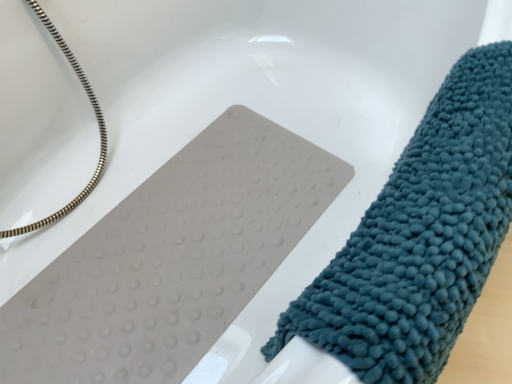
What do you see at coordinates (420, 237) in the screenshot? Image resolution: width=512 pixels, height=384 pixels. I see `teal textured towel at right` at bounding box center [420, 237].

Where is `teal textured towel at right`? The width and height of the screenshot is (512, 384). teal textured towel at right is located at coordinates (420, 237).

Measure the distance between silver metallic hose at upper left and camera.

silver metallic hose at upper left and camera are 32.68 inches apart.

Locate an element on the screen. The image size is (512, 384). silver metallic hose at upper left is located at coordinates (99, 131).

This screenshot has height=384, width=512. What do you see at coordinates (99, 131) in the screenshot? I see `silver metallic hose at upper left` at bounding box center [99, 131].

The height and width of the screenshot is (384, 512). I want to click on teal textured towel at right, so click(x=420, y=237).

Which is more to the right, silver metallic hose at upper left or teal textured towel at right?

teal textured towel at right.

Is silver metallic hose at upper left positioned before teal textured towel at right?

No, it is not.

Which is in front, point (79, 197) or point (422, 272)?

Positioned in front is point (422, 272).

From the image's perspective, which one is positioned lower, silver metallic hose at upper left or teal textured towel at right?

From the image's view, teal textured towel at right is below.

From a real-world perspective, relative to teal textured towel at right, is silver metallic hose at upper left vertically above or below?

Clearly, from a real-world perspective, silver metallic hose at upper left is below teal textured towel at right.

Which of these two, silver metallic hose at upper left or teal textured towel at right, is thinner?

teal textured towel at right.

Who is taller, silver metallic hose at upper left or teal textured towel at right?

silver metallic hose at upper left.

Considering the relative sizes of silver metallic hose at upper left and teal textured towel at right in the image provided, is silver metallic hose at upper left smaller than teal textured towel at right?

Actually, silver metallic hose at upper left might be larger than teal textured towel at right.

Do you think silver metallic hose at upper left is within teal textured towel at right, or outside of it?

silver metallic hose at upper left is located beyond the bounds of teal textured towel at right.

Is silver metallic hose at upper left not near teal textured towel at right?

Actually, silver metallic hose at upper left and teal textured towel at right are a little close together.

Is silver metallic hose at upper left looking in the opposite direction of teal textured towel at right?

No, silver metallic hose at upper left's orientation is not away from teal textured towel at right.

What's the angular difference between silver metallic hose at upper left and teal textured towel at right's facing directions?

They differ by 25 degrees in their facing directions.

Measure the distance from silver metallic hose at upper left to teal textured towel at right.

silver metallic hose at upper left and teal textured towel at right are 77.47 centimeters apart.

You are a GUI agent. You are given a task and a screenshot of the screen. Output one action in this format:
    pyautogui.click(x=<x>, y=<y>)
    Task: Click on the rope behind the teal textured towel at right
    
    Given the screenshot: What is the action you would take?
    pyautogui.click(x=99, y=131)

Does teal textured towel at right appear on the left side of silver metallic hose at upper left?

In fact, teal textured towel at right is to the right of silver metallic hose at upper left.

Which object is closer to the camera, teal textured towel at right or silver metallic hose at upper left?

teal textured towel at right is more forward.

Does point (337, 322) lie in front of point (27, 1)?

That is True.

From the image's perspective, which object appears higher, teal textured towel at right or silver metallic hose at upper left?

From the image's view, silver metallic hose at upper left is above.

From a real-world perspective, which object rests below the other?

silver metallic hose at upper left is physically lower.

Considering the sizes of teal textured towel at right and silver metallic hose at upper left in the image, is teal textured towel at right wider or thinner than silver metallic hose at upper left?

Considering their sizes, teal textured towel at right looks slimmer than silver metallic hose at upper left.

Considering the relative sizes of teal textured towel at right and silver metallic hose at upper left in the image provided, is teal textured towel at right taller than silver metallic hose at upper left?

No, teal textured towel at right is not taller than silver metallic hose at upper left.

Considering the sizes of objects teal textured towel at right and silver metallic hose at upper left in the image provided, who is bigger, teal textured towel at right or silver metallic hose at upper left?

With larger size is silver metallic hose at upper left.

Can silver metallic hose at upper left be found inside teal textured towel at right?

No.

Is teal textured towel at right positioned far away from silver metallic hose at upper left?

No, teal textured towel at right is not far from silver metallic hose at upper left.

Could you tell me if teal textured towel at right is turned towards silver metallic hose at upper left?

No, teal textured towel at right is not aimed at silver metallic hose at upper left.

How different are the orientations of teal textured towel at right and silver metallic hose at upper left in degrees?

25 degrees separate the facing orientations of teal textured towel at right and silver metallic hose at upper left.

Where is `rope on the left of the teal textured towel at right`? This screenshot has height=384, width=512. rope on the left of the teal textured towel at right is located at coordinates (99, 131).

I want to click on towel above the silver metallic hose at upper left (from a real-world perspective), so pyautogui.click(x=420, y=237).

Image resolution: width=512 pixels, height=384 pixels. Find the location of `rope below the teal textured towel at right (from a real-world perspective)`. rope below the teal textured towel at right (from a real-world perspective) is located at coordinates (99, 131).